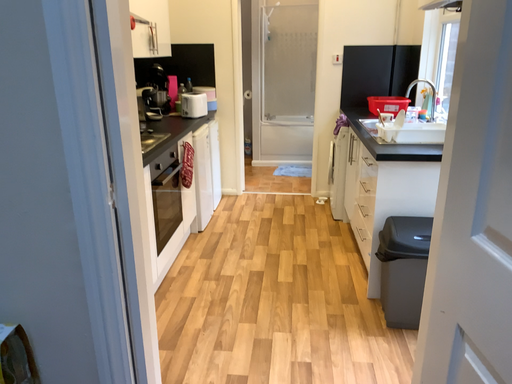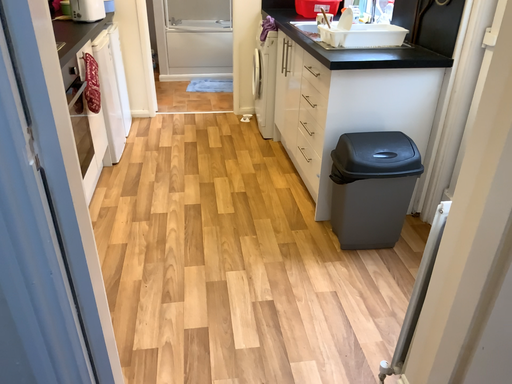
Question: Which way did the camera rotate in the video?

Choices:
 (A) rotated left
 (B) rotated right

Answer: (B)